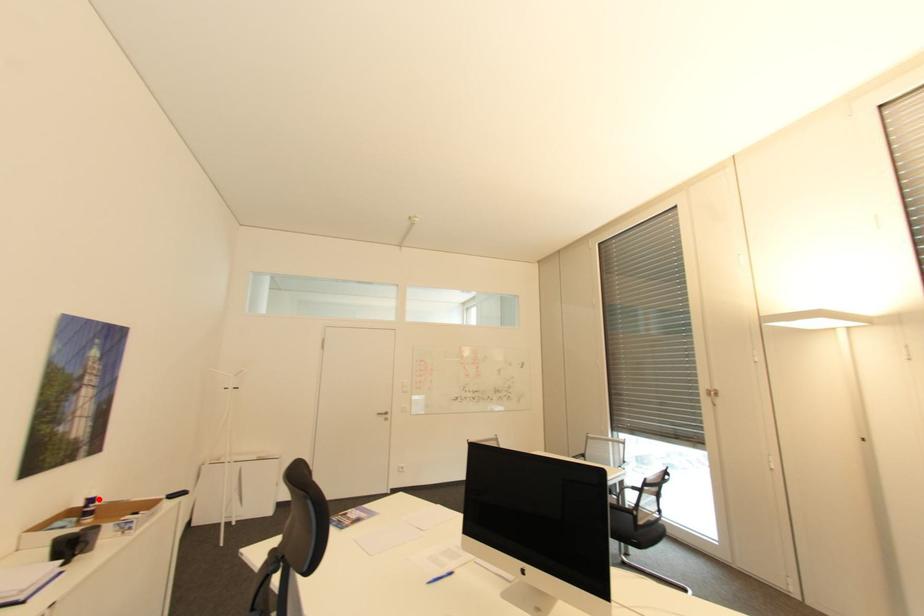
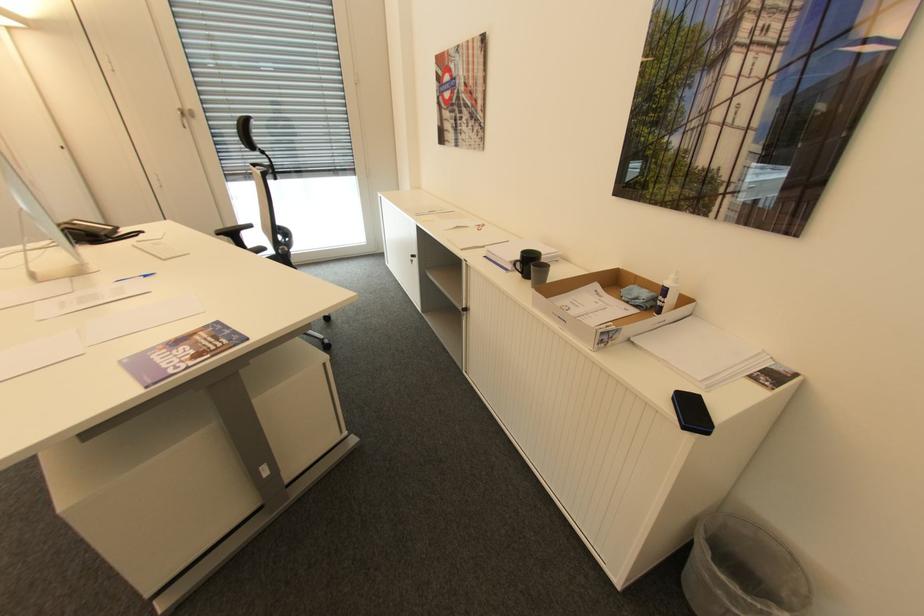
The point at the highlighted location is marked in the first image. Where is the corresponding point in the second image?

(670, 291)